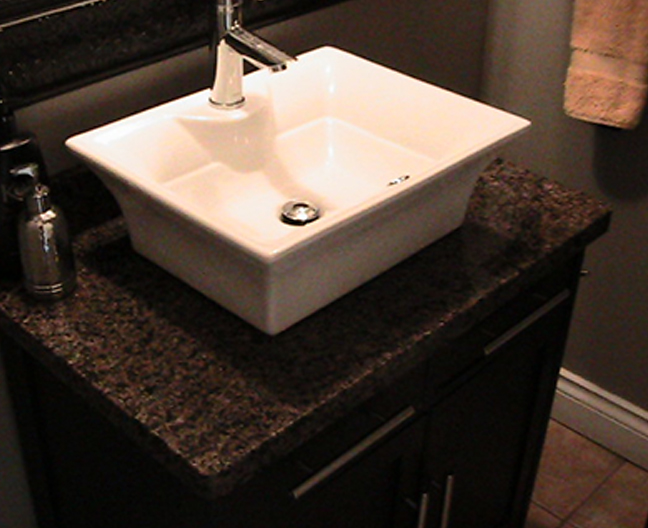
At what (x,y) coordinates should I click in order to perform the action: click on countertop. Please return your answer as a coordinate pair (x, y). Looking at the image, I should click on (389, 331).